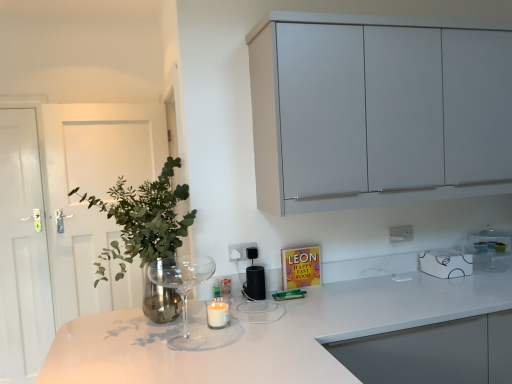
Locate an element on the screen. white glossy microwave at upper right, which ranks as the first appliance in right-to-left order is located at coordinates (490, 247).

You are a GUI agent. You are given a task and a screenshot of the screen. Output one action in this format:
    pyautogui.click(x=<x>, y=<y>)
    Task: Click on the white plastic electric outlet at center, placed as the first electric outlet when sorted from left to right
    
    Given the screenshot: What is the action you would take?
    pyautogui.click(x=240, y=251)

Where is `white glossy door at left`? This screenshot has height=384, width=512. white glossy door at left is located at coordinates (22, 250).

Where is `white glossy microwave at upper right, which ranks as the first appliance in right-to-left order`? white glossy microwave at upper right, which ranks as the first appliance in right-to-left order is located at coordinates (490, 247).

Considering the relative positions of white glossy door at left and white wooden door at left in the image provided, is white glossy door at left to the left of white wooden door at left from the viewer's perspective?

Yes, white glossy door at left is to the left of white wooden door at left.

Between white glossy door at left and white wooden door at left, which one has less height?

white wooden door at left is shorter.

From a real-world perspective, which object stands above the other?

From a 3D spatial view, white plastic electric outlet at upper center, arranged as the second electric outlet when viewed from the left, is above.

Can you tell me how much white plastic electric outlet at center, placed as the 1th electric outlet when sorted from front to back, and white plastic electric outlet at upper center, which appears as the 1th electric outlet when viewed from the back, differ in facing direction?

They differ by 0.0702 degrees in their facing directions.

From the image's perspective, is white plastic electric outlet at center, placed as the first electric outlet when sorted from left to right, located above or below white plastic electric outlet at upper center, arranged as the second electric outlet when viewed from the left?

Clearly, from the image's perspective, white plastic electric outlet at center, placed as the first electric outlet when sorted from left to right, is below white plastic electric outlet at upper center, arranged as the second electric outlet when viewed from the left.

Is white plastic electric outlet at center, placed as the 1th electric outlet when sorted from front to back, aimed at white plastic electric outlet at upper center, which appears as the second electric outlet when viewed from the front?

No.

Is point (29, 372) farther from camera compared to point (506, 147)?

Yes, it is.

Between white glossy door at left and matte gray cabinet at upper right, which one has smaller size?

white glossy door at left is smaller.

From a real-world perspective, does white glossy door at left stand above matte gray cabinet at upper right?

No, from a real-world perspective, white glossy door at left is not over matte gray cabinet at upper right

Measure the distance from white glossy door at left to matte gray cabinet at upper right.

7.11 feet.

Considering the positions of objects transparent glass wine glass at lower left and white plastic electric outlet at upper center, arranged as the second electric outlet when viewed from the left, in the image provided, who is in front, transparent glass wine glass at lower left or white plastic electric outlet at upper center, arranged as the second electric outlet when viewed from the left,?

transparent glass wine glass at lower left is closer to the camera.

Between transparent glass wine glass at lower left and white plastic electric outlet at upper center, which appears as the 1th electric outlet when viewed from the right, which one has more height?

transparent glass wine glass at lower left is taller.

Is transparent glass wine glass at lower left facing towards white plastic electric outlet at upper center, arranged as the second electric outlet when viewed from the left?

No, transparent glass wine glass at lower left is not turned towards white plastic electric outlet at upper center, arranged as the second electric outlet when viewed from the left.

Which object is closer to the camera taking this photo, white glossy countertop at center or white plastic electric outlet at center, the 2th electric outlet positioned from the back?

Positioned in front is white glossy countertop at center.

Considering the relative sizes of white glossy countertop at center and white plastic electric outlet at center, placed as the 1th electric outlet when sorted from front to back, in the image provided, is white glossy countertop at center bigger than white plastic electric outlet at center, placed as the 1th electric outlet when sorted from front to back,?

Yes, white glossy countertop at center is bigger than white plastic electric outlet at center, placed as the 1th electric outlet when sorted from front to back.

From a real-world perspective, which object stands above the other?

From a 3D spatial view, white plastic electric outlet at center, the 2th electric outlet positioned from the back, is above.

Does white glossy countertop at center turn towards white plastic electric outlet at center, which appears as the second electric outlet when viewed from the right?

No, white glossy countertop at center is not aimed at white plastic electric outlet at center, which appears as the second electric outlet when viewed from the right.

Starting from the white plastic electric outlet at center, placed as the 1th electric outlet when sorted from front to back, which appliance is the 1st one to the right? Please provide its 2D coordinates.

[(256, 282)]

Looking at this image, from a real-world perspective, relative to white plastic electric outlet at center, which appears as the second electric outlet when viewed from the right, is black matte speaker at center, arranged as the first appliance when viewed from the left, vertically above or below?

black matte speaker at center, arranged as the first appliance when viewed from the left, is situated lower than white plastic electric outlet at center, which appears as the second electric outlet when viewed from the right, in the real world.

Is point (255, 276) farther from viewer compared to point (234, 249)?

No, it is not.

How many degrees apart are the facing directions of black matte speaker at center, which is the third appliance in right-to-left order, and white plastic electric outlet at center, placed as the first electric outlet when sorted from left to right?

black matte speaker at center, which is the third appliance in right-to-left order, and white plastic electric outlet at center, placed as the first electric outlet when sorted from left to right, are facing 1.74 degrees away from each other.

Which object is thinner, white glossy coffee cup at upper right, positioned as the 2th appliance in left-to-right order, or black matte speaker at center, which is the third appliance in right-to-left order?

With smaller width is black matte speaker at center, which is the third appliance in right-to-left order.

Does white glossy coffee cup at upper right, positioned as the second appliance in right-to-left order, have a larger size compared to black matte speaker at center, which is the third appliance in right-to-left order?

Yes.

Can black matte speaker at center, arranged as the first appliance when viewed from the left, be found inside white glossy coffee cup at upper right, positioned as the second appliance in right-to-left order?

That's incorrect, black matte speaker at center, arranged as the first appliance when viewed from the left, is not inside white glossy coffee cup at upper right, positioned as the second appliance in right-to-left order.

From a real-world perspective, which object stands above the other?

black matte speaker at center, which is the third appliance in right-to-left order, is physically above.

In order to click on door above the white glossy door at left (from a real-world perspective) in this screenshot , I will do `click(94, 194)`.

At what (x,y) coordinates should I click in order to perform the action: click on electric outlet that appears below the white plastic electric outlet at upper center, which appears as the 1th electric outlet when viewed from the right (from the image's perspective). Please return your answer as a coordinate pair (x, y). Looking at the image, I should click on (240, 251).

From the image, which object appears to be nearer to black matte speaker at center, which is the third appliance in right-to-left order, white wooden door at left or white glossy coffee cup at upper right, positioned as the second appliance in right-to-left order?

Based on the image, white glossy coffee cup at upper right, positioned as the second appliance in right-to-left order, appears to be nearer to black matte speaker at center, which is the third appliance in right-to-left order.

Looking at this image, estimate the real-world distances between objects in this image. Which object is further from white glossy countertop at center, white glossy microwave at upper right, acting as the third appliance starting from the left, or white wooden door at left?

white wooden door at left is positioned further to the anchor white glossy countertop at center.

When comparing their distances from matte gray cabinet at upper right, does white glossy coffee cup at upper right, positioned as the 2th appliance in left-to-right order, or transparent glass wine glass at lower left seem closer?

white glossy coffee cup at upper right, positioned as the 2th appliance in left-to-right order.

Based on the photo, considering their positions, is white plastic electric outlet at upper center, arranged as the second electric outlet when viewed from the left, positioned closer to white glossy microwave at upper right, acting as the third appliance starting from the left, than white glossy coffee cup at upper right, positioned as the 2th appliance in left-to-right order?

white glossy coffee cup at upper right, positioned as the 2th appliance in left-to-right order.

Estimate the real-world distances between objects in this image. Which object is further from white wooden door at left, white glossy countertop at center or matte gray cabinet at upper right?

Result: matte gray cabinet at upper right is positioned further to the anchor white wooden door at left.

Based on their spatial positions, is white plastic electric outlet at upper center, arranged as the second electric outlet when viewed from the left, or white glossy microwave at upper right, acting as the third appliance starting from the left, further from black matte speaker at center, which is the third appliance in right-to-left order?

The object further to black matte speaker at center, which is the third appliance in right-to-left order, is white glossy microwave at upper right, acting as the third appliance starting from the left.

Which object lies nearer to the anchor point transparent glass wine glass at lower left, white glossy door at left or white glossy countertop at center?

white glossy countertop at center lies closer to transparent glass wine glass at lower left than the other object.

Looking at the image, which one is located further to white plastic electric outlet at upper center, which appears as the 1th electric outlet when viewed from the right, transparent glass wine glass at lower left or white wooden door at left?

white wooden door at left is positioned further to the anchor white plastic electric outlet at upper center, which appears as the 1th electric outlet when viewed from the right.

The image size is (512, 384). Identify the location of electric outlet between black matte speaker at center, arranged as the first appliance when viewed from the left, and white glossy coffee cup at upper right, positioned as the 2th appliance in left-to-right order, in the horizontal direction. (400, 233).

The width and height of the screenshot is (512, 384). In order to click on cabinetry between white glossy door at left and white glossy microwave at upper right, acting as the third appliance starting from the left, from left to right in this screenshot , I will do `click(378, 110)`.

You are a GUI agent. You are given a task and a screenshot of the screen. Output one action in this format:
    pyautogui.click(x=<x>, y=<y>)
    Task: Click on the countertop between black matte speaker at center, arranged as the first appliance when viewed from the left, and white glossy microwave at upper right, acting as the third appliance starting from the left, from left to right
    
    Given the screenshot: What is the action you would take?
    click(269, 334)

The image size is (512, 384). In order to click on electric outlet between white wooden door at left and white plastic electric outlet at upper center, which appears as the 1th electric outlet when viewed from the right in this screenshot , I will do `click(240, 251)`.